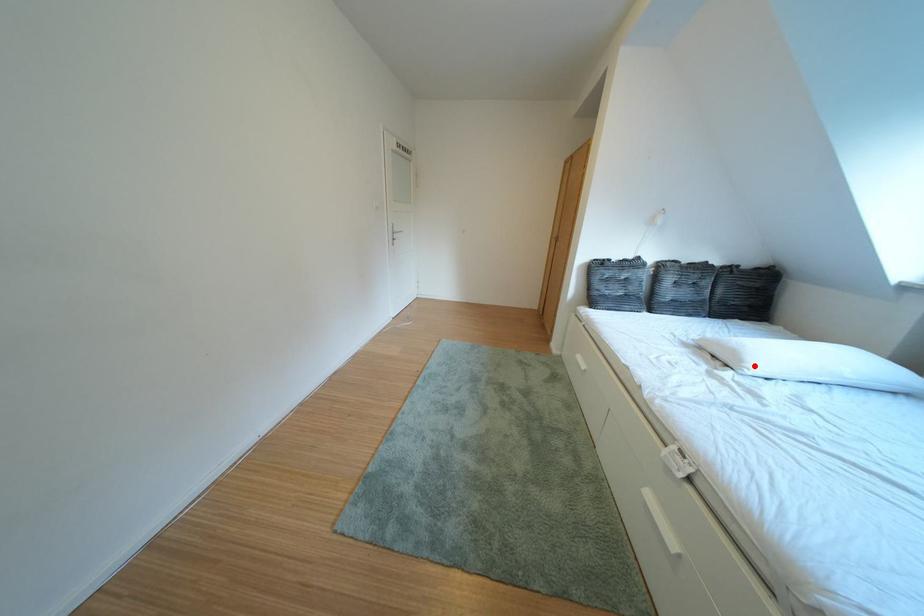
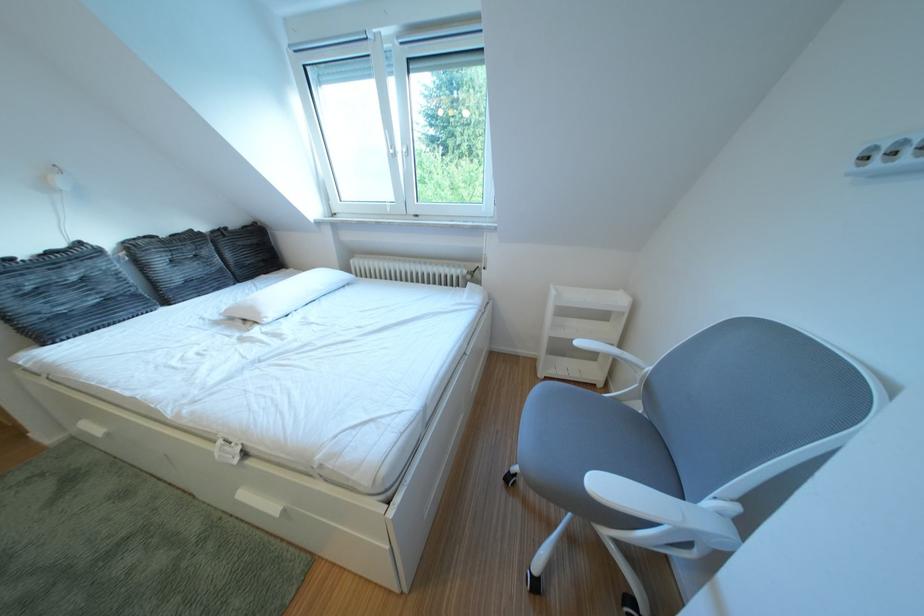
Find the pixel in the second image that matches the highlighted location in the first image.

(273, 318)